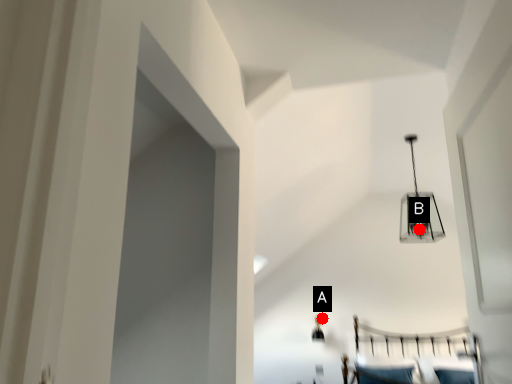
Question: Two points are circled on the image, labeled by A and B beside each circle. Which of the following is the farthest from the observer?

Choices:
 (A) A is further
 (B) B is further

Answer: (B)